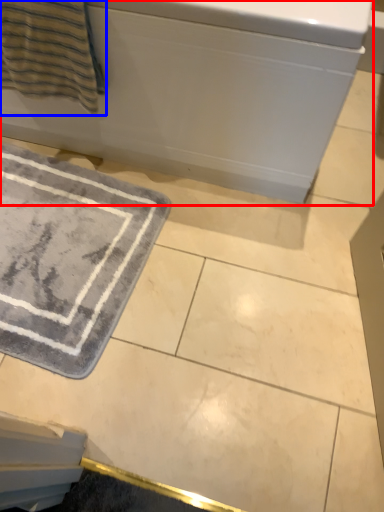
Question: Among these objects, which one is farthest to the camera, bath (highlighted by a red box) or beach towel (highlighted by a blue box)?

Choices:
 (A) bath
 (B) beach towel

Answer: (B)